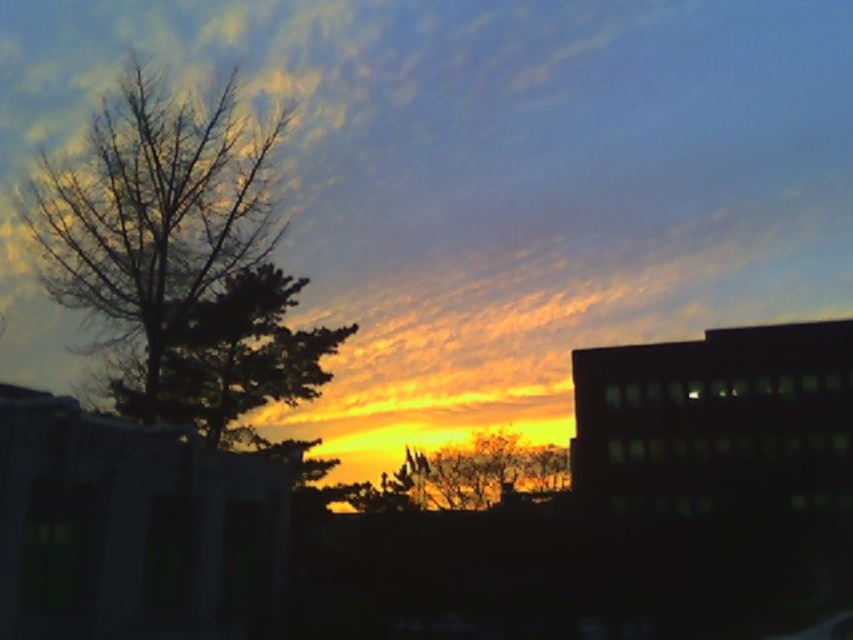
What is the exact coordinate of the cloudy sky at center in the image?

The cloudy sky at center is located at point (482, 184).